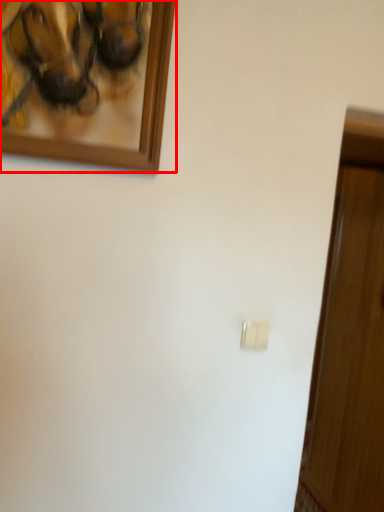
Question: Where is picture frame (annotated by the red box) located in relation to light switch in the image?

Choices:
 (A) left
 (B) right

Answer: (A)